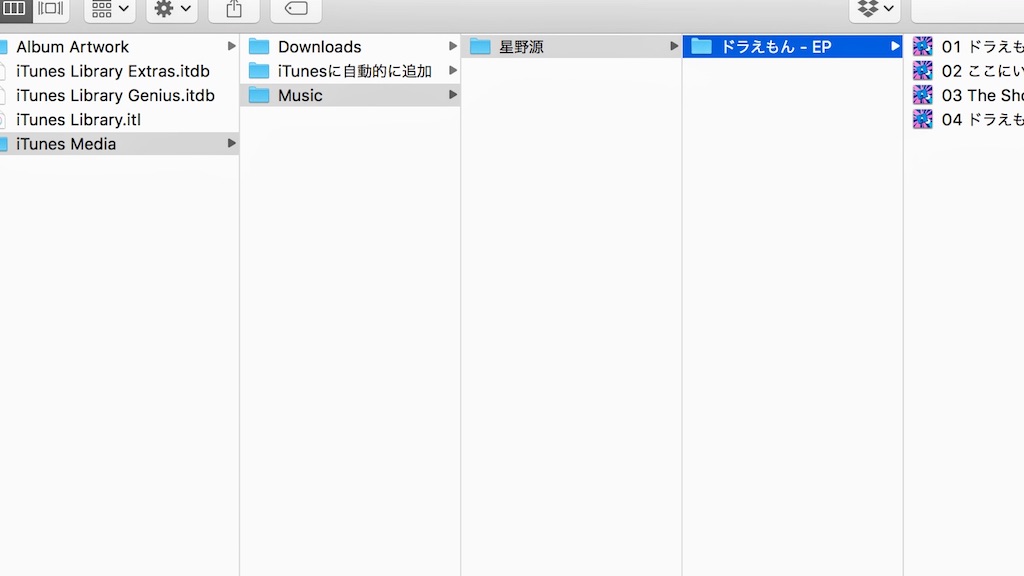
Where is `folders`? folders is located at coordinates (93, 44), (85, 142), (269, 89), (282, 63), (297, 43), (476, 48), (733, 44).